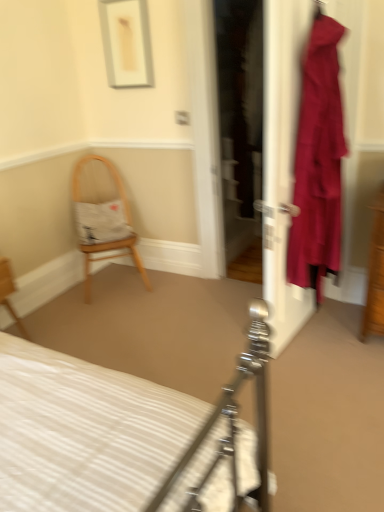
Question: Considering the positions of matte white door at right and white striped fabric bed at center in the image, is matte white door at right taller or shorter than white striped fabric bed at center?

Choices:
 (A) short
 (B) tall

Answer: (B)

Question: In terms of size, does matte white door at right appear bigger or smaller than white striped fabric bed at center?

Choices:
 (A) big
 (B) small

Answer: (B)

Question: Which object is the farthest from the velvet-like burgundy dress at right?

Choices:
 (A) white striped fabric bed at center
 (B) wooden chair at lower left, placed as the 2th chair when sorted from back to front
 (C) matte white door at right
 (D) wooden chair with cushion at left, the second chair viewed from the front

Answer: (B)

Question: Which of these objects is positioned closest to the matte white door at right?

Choices:
 (A) velvet-like burgundy dress at right
 (B) wooden chair at lower left, which ranks as the first chair in front-to-back order
 (C) wooden chair with cushion at left, the second chair viewed from the front
 (D) white striped fabric bed at center

Answer: (A)